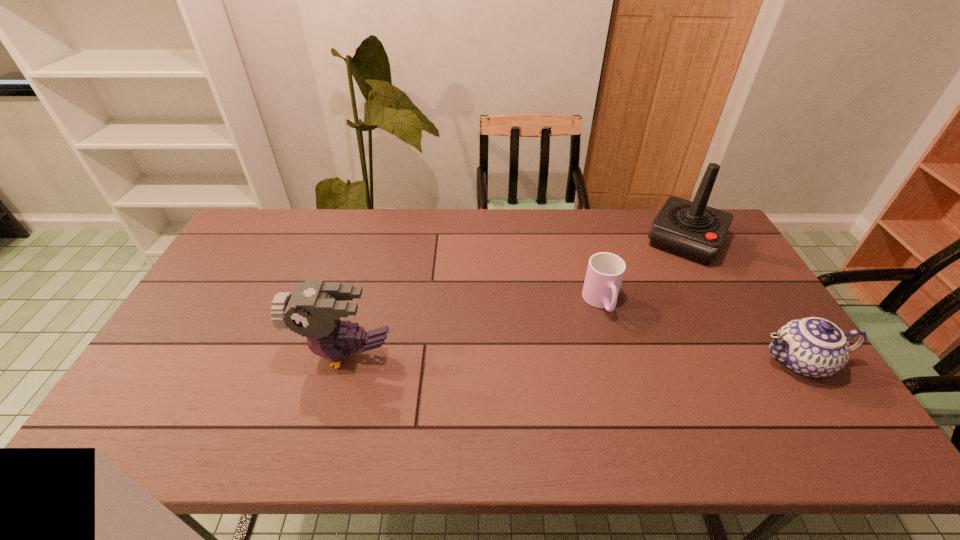
The image size is (960, 540). In order to click on object that is the third closest to the second tallest object in this screenshot , I will do `click(813, 347)`.

Where is `the third closest object to the cup`? the third closest object to the cup is located at coordinates (313, 310).

You are a GUI agent. You are given a task and a screenshot of the screen. Output one action in this format:
    pyautogui.click(x=<x>, y=<y>)
    Task: Click on the vacant space that satisfies the following two spatial constraints: 1. on the front side of the chinaware; 2. from the spout of the farthest object
    
    Given the screenshot: What is the action you would take?
    pyautogui.click(x=751, y=361)

Image resolution: width=960 pixels, height=540 pixels. I want to click on vacant region that satisfies the following two spatial constraints: 1. on the front side of the chinaware; 2. from the spout of the second farthest object, so click(617, 361).

Locate an element on the screen. free point that satisfies the following two spatial constraints: 1. on the back side of the tallest object; 2. on the right side of the cup is located at coordinates (584, 241).